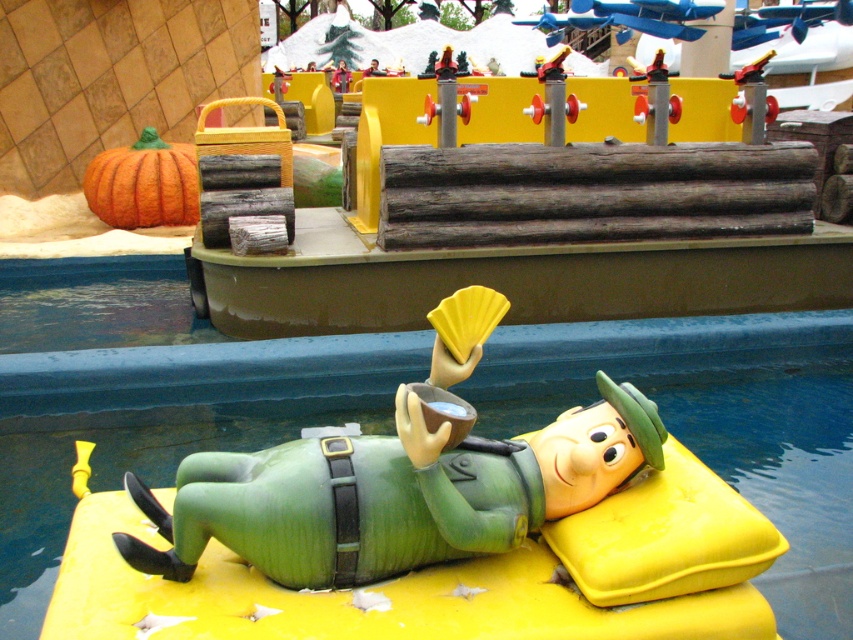
Can you confirm if blue smooth water at lower center is thinner than smooth green figure at center?

Incorrect, blue smooth water at lower center's width is not less than smooth green figure at center's.

Where is `blue smooth water at lower center`? This screenshot has width=853, height=640. blue smooth water at lower center is located at coordinates (148, 396).

Does smooth green figure at center have a lesser height compared to orange matte pumpkin at upper left?

Indeed, smooth green figure at center has a lesser height compared to orange matte pumpkin at upper left.

Between point (178, 497) and point (155, 160), which one is positioned in front?

Positioned in front is point (178, 497).

What are the coordinates of `smooth green figure at center` in the screenshot? It's located at (393, 493).

Find the location of a particular element. blue smooth water at lower center is located at coordinates (148, 396).

What do you see at coordinates (148, 396) in the screenshot? This screenshot has width=853, height=640. I see `blue smooth water at lower center` at bounding box center [148, 396].

The height and width of the screenshot is (640, 853). I want to click on blue smooth water at lower center, so click(x=148, y=396).